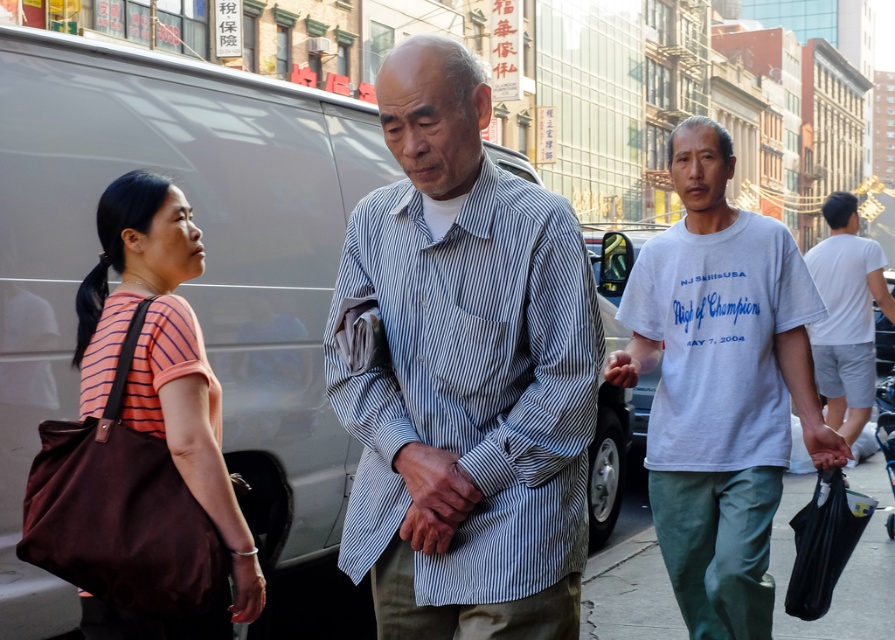
Does silver metallic van at center have a greater width compared to matte brown tote bag at left?

Yes.

Who is positioned more to the right, silver metallic van at center or matte brown tote bag at left?

From the viewer's perspective, matte brown tote bag at left appears more on the right side.

Does point (316, 340) lie in front of point (182, 330)?

That is False.

At what (x,y) coordinates should I click in order to perform the action: click on silver metallic van at center. Please return your answer as a coordinate pair (x, y). The height and width of the screenshot is (640, 895). Looking at the image, I should click on (182, 282).

Does striped cotton shirt at center have a smaller size compared to green fabric pants at lower right?

Incorrect, striped cotton shirt at center is not smaller in size than green fabric pants at lower right.

Does striped cotton shirt at center appear under green fabric pants at lower right?

Incorrect, striped cotton shirt at center is not positioned below green fabric pants at lower right.

What do you see at coordinates (465, 374) in the screenshot? I see `striped cotton shirt at center` at bounding box center [465, 374].

This screenshot has width=895, height=640. Identify the location of striped cotton shirt at center. (465, 374).

Does striped cotton shirt at center have a larger size compared to white cotton t-shirt at center-right?

Incorrect, striped cotton shirt at center is not larger than white cotton t-shirt at center-right.

Can you confirm if striped cotton shirt at center is positioned above white cotton t-shirt at center-right?

Correct, striped cotton shirt at center is located above white cotton t-shirt at center-right.

Locate an element on the screen. striped cotton shirt at center is located at coordinates (465, 374).